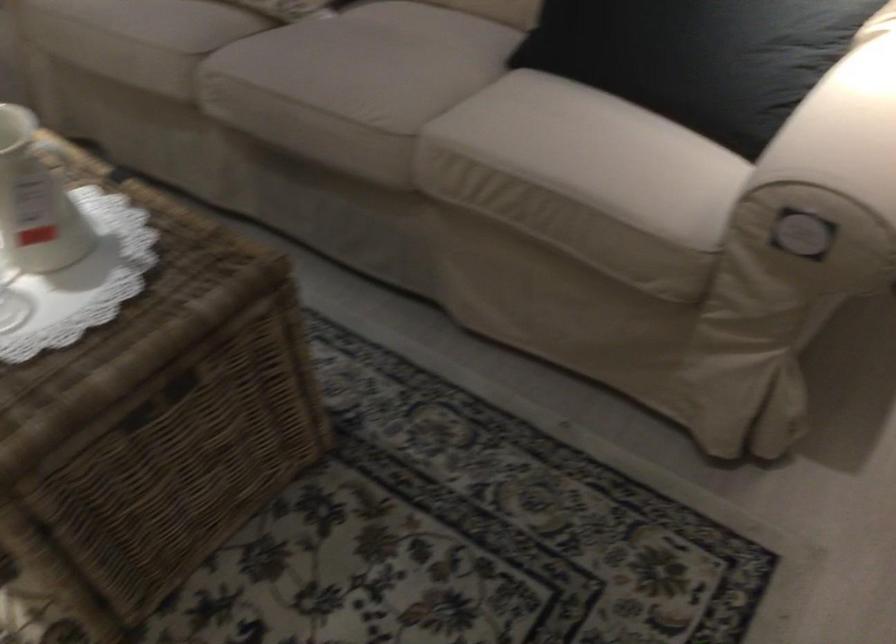
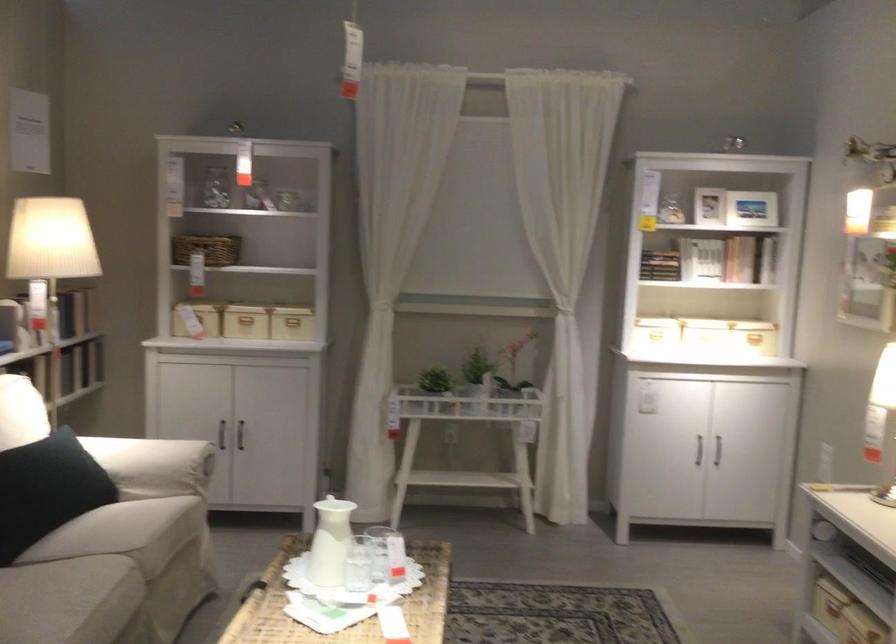
The point at (385, 108) is marked in the first image. Where is the corresponding point in the second image?

(110, 576)